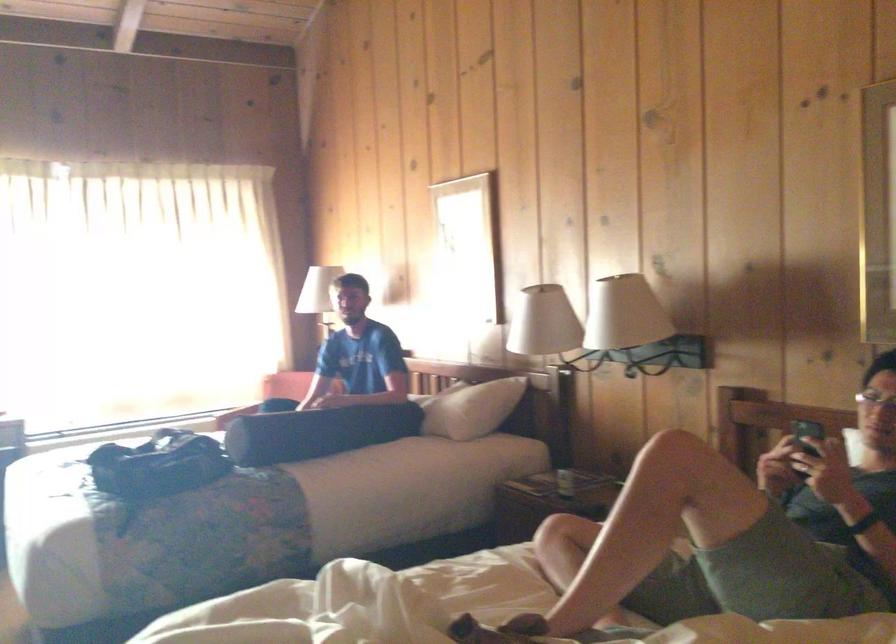
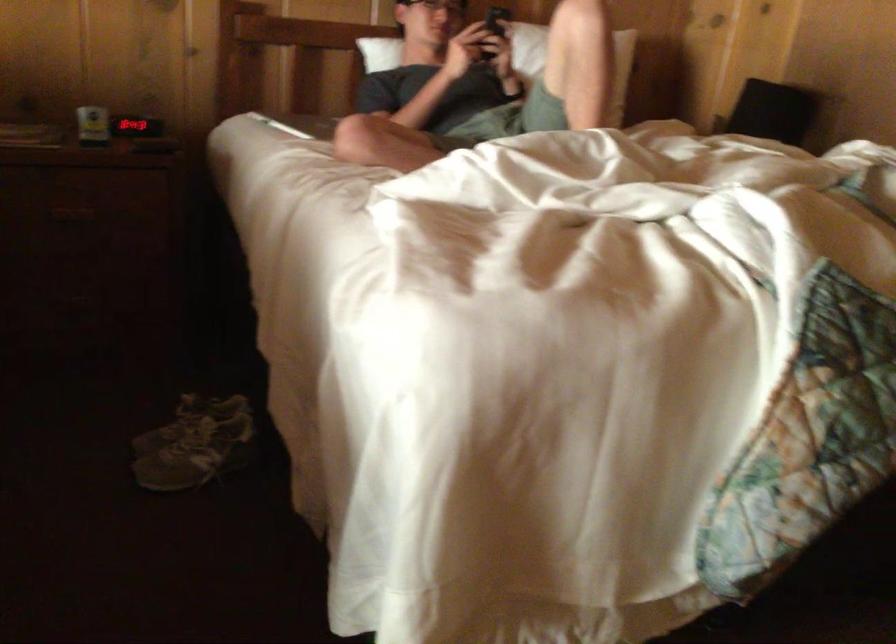
The point at (644,516) is marked in the first image. Where is the corresponding point in the second image?

(573, 61)